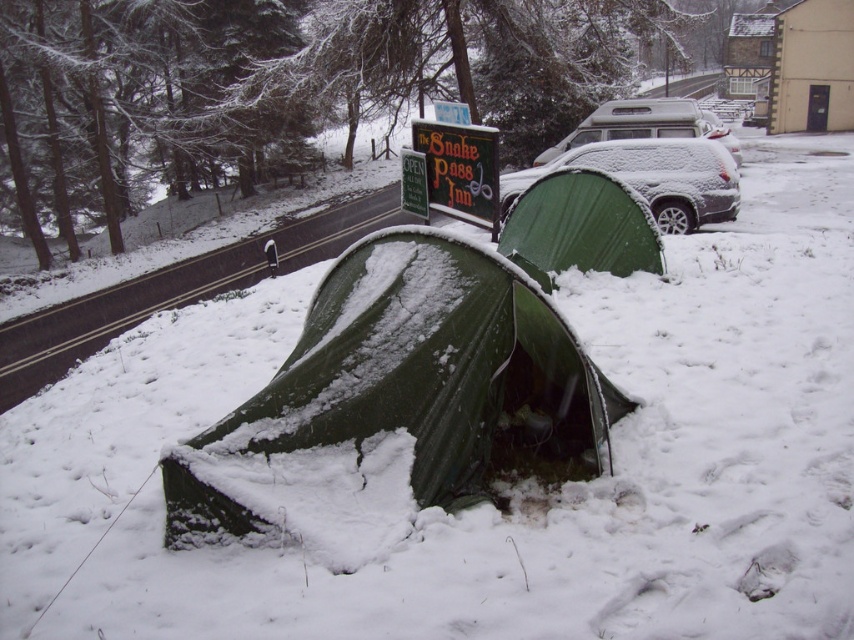
You are a hiker who just arrived at the snowy area. You see the green tarpaulin tent at center and the green painted wood sign at center. Which object is closer to you?

The green tarpaulin tent at center is closer to you because it is in front of the green painted wood sign at center.

You are standing at the point marked by coordinates point [580,227]. Looking around, you notice a road and some trees. Which direction should you walk to reach the trees on the opposite side of the road?

The trees are on the opposite side of the road from the green fabric tent at center represented by point [580,227]. To reach them, walk towards the trees across the road.